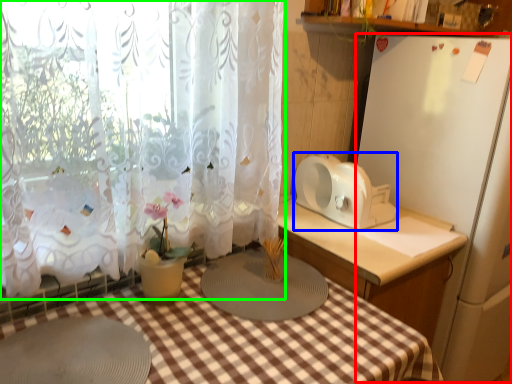
Question: Which object is positioned farthest from appliance (highlighted by a red box)? Select from appliance (highlighted by a blue box) and curtain (highlighted by a green box).

Choices:
 (A) appliance
 (B) curtain

Answer: (B)